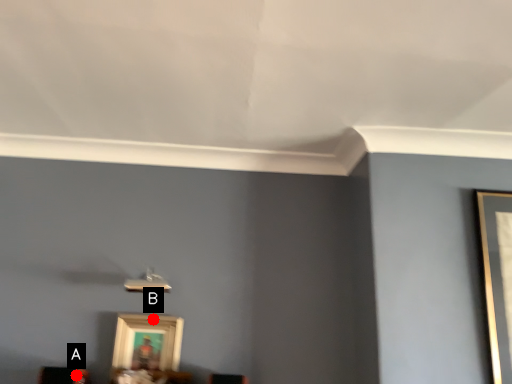
Question: Two points are circled on the image, labeled by A and B beside each circle. Which point is farther from the camera taking this photo?

Choices:
 (A) A is further
 (B) B is further

Answer: (B)